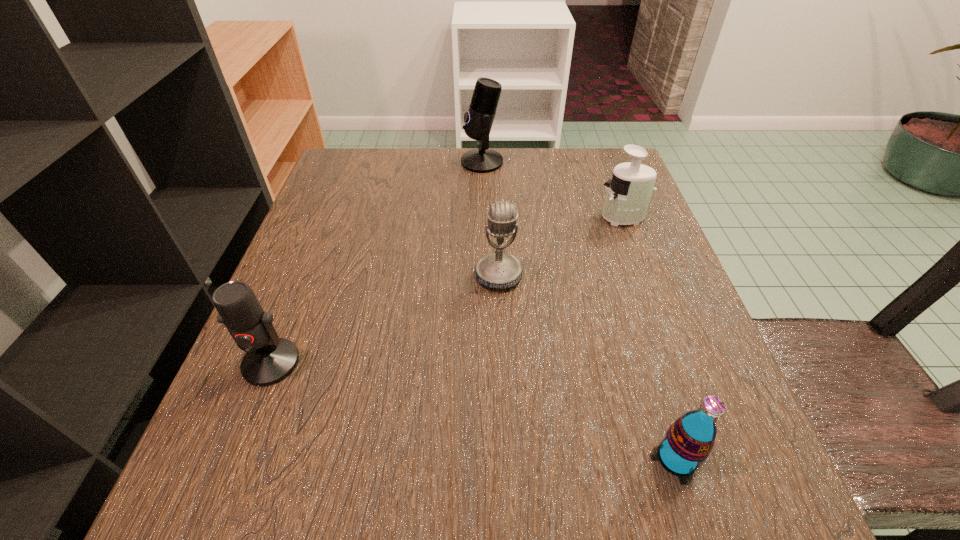
The height and width of the screenshot is (540, 960). I want to click on the tallest microphone, so click(479, 119).

This screenshot has height=540, width=960. I want to click on the farthest object, so click(x=479, y=119).

Identify the location of the second nearest microphone. This screenshot has width=960, height=540. (498, 270).

Where is `juicer`? juicer is located at coordinates (629, 192).

Where is `the leftmost object`? The image size is (960, 540). the leftmost object is located at coordinates (269, 359).

Find the location of a particular element. The height and width of the screenshot is (540, 960). the fourth farthest object is located at coordinates click(269, 359).

Identify the location of the shortest object. This screenshot has width=960, height=540. (689, 440).

The height and width of the screenshot is (540, 960). I want to click on the nearest object, so click(x=689, y=440).

Image resolution: width=960 pixels, height=540 pixels. Identify the location of vacant space located 0.230m on the stand of the farthest microphone. (369, 161).

What are the coordinates of `free space located 0.300m on the stand of the farthest microphone` in the screenshot? It's located at (341, 161).